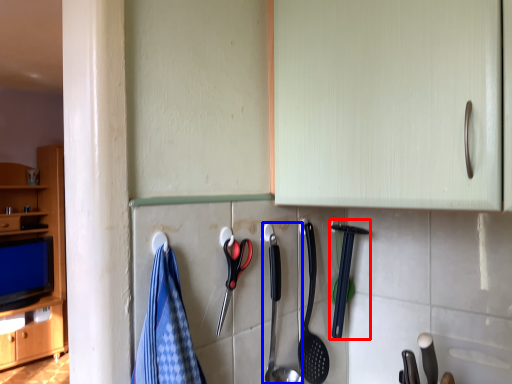
Question: Which point is closer to the camera, silverware (highlighted by a red box) or silverware (highlighted by a blue box)?

Choices:
 (A) silverware
 (B) silverware

Answer: (B)